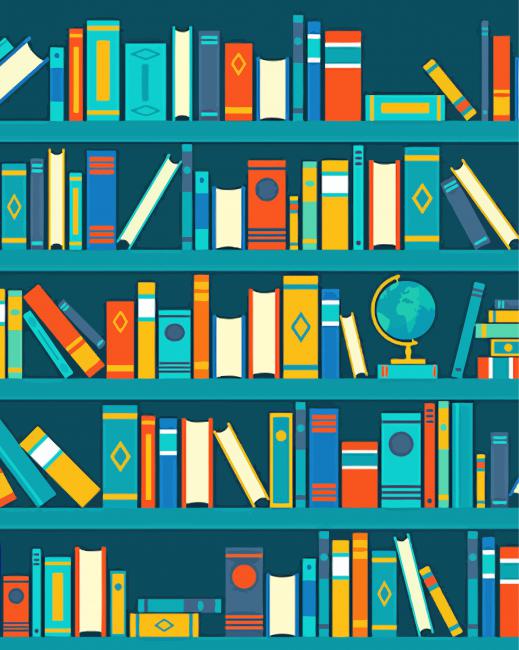
You are a GUI agent. You are given a task and a screenshot of the screen. Output one action in this format:
    pyautogui.click(x=<x>, y=<y>)
    Task: Click on the shelves
    
    Given the screenshot: What is the action you would take?
    pyautogui.click(x=243, y=644), pyautogui.click(x=236, y=521), pyautogui.click(x=251, y=393), pyautogui.click(x=245, y=266), pyautogui.click(x=275, y=130)